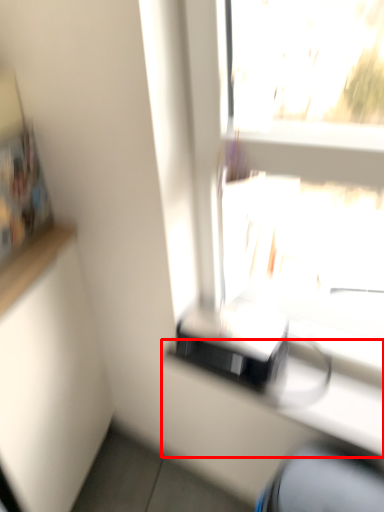
Question: Where is counter (annotated by the red box) located in relation to computer chair in the image?

Choices:
 (A) right
 (B) left

Answer: (B)